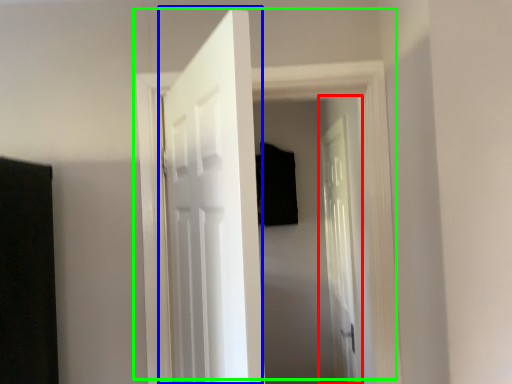
Question: Based on their relative distances, which object is farther from door (highlighted by a red box)? Choose from door (highlighted by a blue box) and door (highlighted by a green box).

Choices:
 (A) door
 (B) door

Answer: (A)